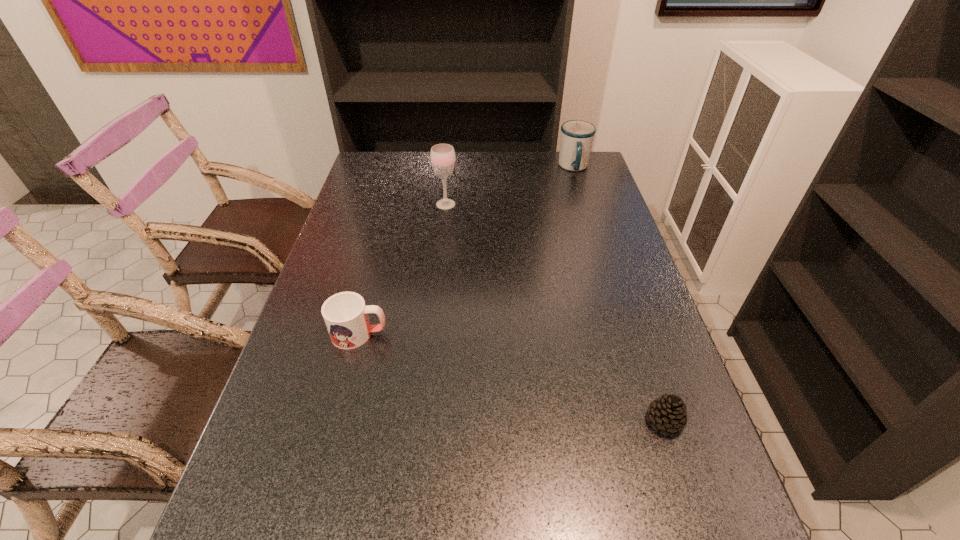
You are a GUI agent. You are given a task and a screenshot of the screen. Output one action in this format:
    pyautogui.click(x=<x>, y=<y>)
    Task: Click on the free spot between the nearer mug and the third object from right to left
    This screenshot has width=960, height=540.
    Given the screenshot: What is the action you would take?
    pyautogui.click(x=402, y=269)

I want to click on blank region between the leftmost object and the tallest object, so click(402, 269).

Locate an element on the screen. unoccupied position between the second nearest object and the pinecone is located at coordinates (512, 377).

Find the location of `the second closest object to the third nearest object`. the second closest object to the third nearest object is located at coordinates (345, 314).

Select which object is the closest to the pinecone. Please provide its 2D coordinates. Your answer should be formatted as a tuple, i.e. [(x, y)], where the tuple contains the x and y coordinates of a point satisfying the conditions above.

[(345, 314)]